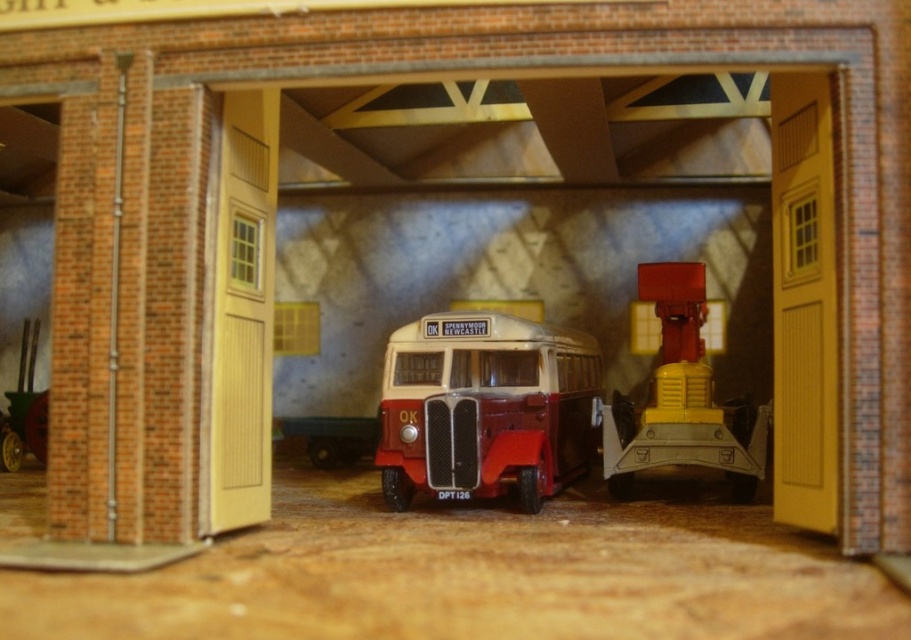
Question: Is matte red bus at center smaller than metallic yellow and red crane at center?

Choices:
 (A) yes
 (B) no

Answer: (B)

Question: Which object appears closest to the camera in this image?

Choices:
 (A) metallic yellow and red crane at center
 (B) matte red bus at center

Answer: (B)

Question: Is matte red bus at center smaller than metallic yellow and red crane at center?

Choices:
 (A) yes
 (B) no

Answer: (B)

Question: Which of the following is the farthest from the observer?

Choices:
 (A) matte red bus at center
 (B) metallic yellow and red crane at center

Answer: (B)

Question: Does matte red bus at center appear over metallic yellow and red crane at center?

Choices:
 (A) no
 (B) yes

Answer: (A)